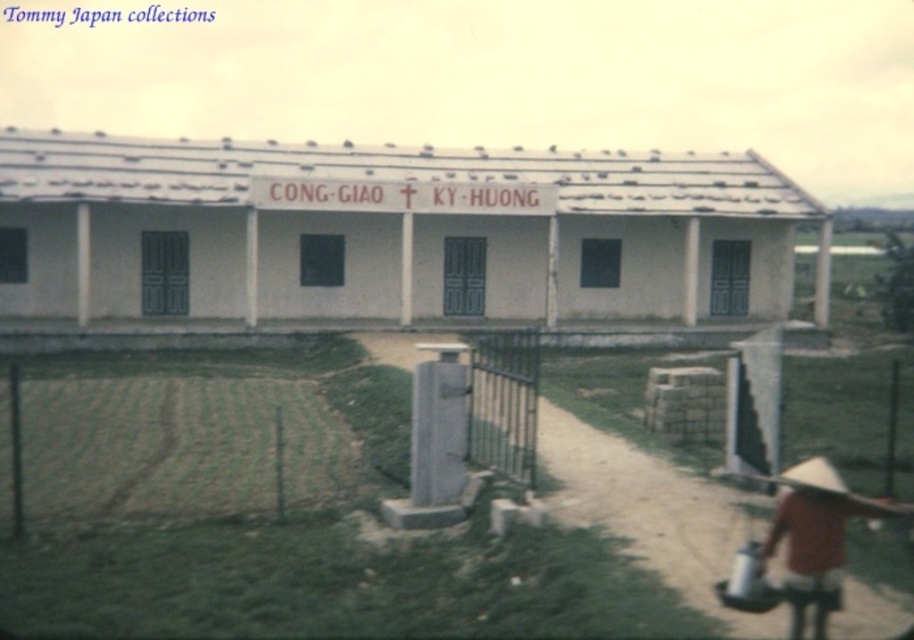
You are standing at the entrance of the building and want to walk to the point marked by point [502,449] and point [835,486]. Which point should you reach first based on their positions?

You should reach point [835,486] first because it is in front of point [502,449].

Consider the image. You are a visitor approaching the metal gate in front of the building. You see a brown straw hat at lower right and a gray concrete pillar at center. Which object is taller?

The brown straw hat at lower right is much taller than the gray concrete pillar at center.